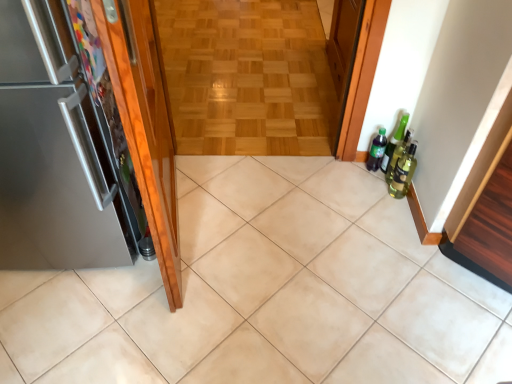
Locate an element on the screen. free spot to the left of green glass beer bottle at right, the first beer bottle positioned from the back is located at coordinates (351, 175).